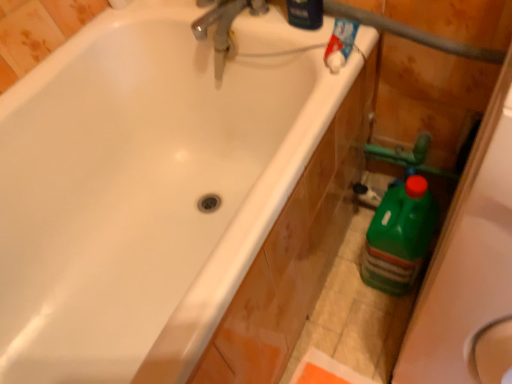
Where is `vacant space behind blue glossy bottle at upper right, placed as the 1th cleaning product when sorted from left to right`? This screenshot has height=384, width=512. vacant space behind blue glossy bottle at upper right, placed as the 1th cleaning product when sorted from left to right is located at coordinates (285, 24).